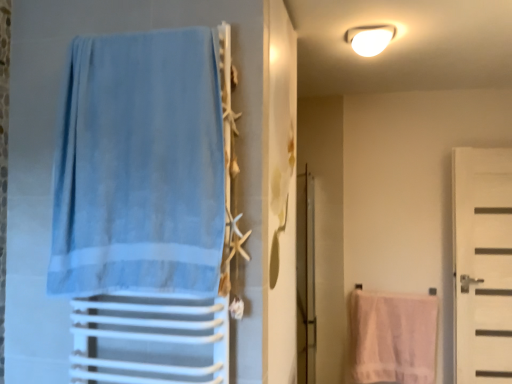
This screenshot has width=512, height=384. I want to click on vacant space situated above white glossy light fixture at upper center (from a real-world perspective), so click(368, 33).